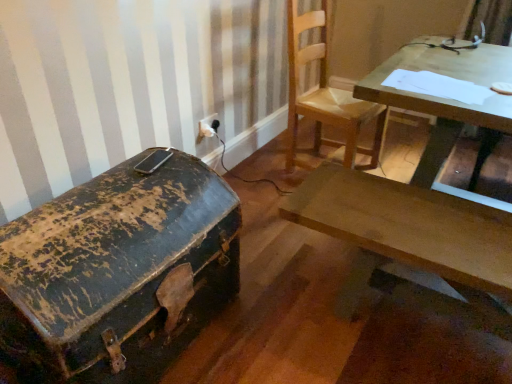
In order to face rusty metal trunk at left, should I rotate leftwards or rightwards?

To align with it, rotate left about 16.250°.

This screenshot has height=384, width=512. Describe the element at coordinates (408, 225) in the screenshot. I see `wooden desk at center` at that location.

Locate an element on the screen. white plastic electric outlet at upper center is located at coordinates (208, 126).

From the image's perspective, does white plastic electric outlet at upper center appear higher than wooden table at upper right?

Yes.

Would you say white plastic electric outlet at upper center is outside wooden table at upper right?

Yes, white plastic electric outlet at upper center is not within wooden table at upper right.

Is white plastic electric outlet at upper center to the left of wooden table at upper right from the viewer's perspective?

Yes, white plastic electric outlet at upper center is to the left of wooden table at upper right.

Is point (200, 134) positioned before point (377, 91)?

No, it is behind (377, 91).

Is rusty metal trunk at left to the left or to the right of white plastic electric outlet at upper center in the image?

rusty metal trunk at left is to the left of white plastic electric outlet at upper center.

Considering the relative sizes of rusty metal trunk at left and white plastic electric outlet at upper center in the image provided, is rusty metal trunk at left shorter than white plastic electric outlet at upper center?

Incorrect, the height of rusty metal trunk at left does not fall short of that of white plastic electric outlet at upper center.

Can white plastic electric outlet at upper center be found inside rusty metal trunk at left?

No, white plastic electric outlet at upper center is not a part of rusty metal trunk at left.

Which point is more distant from viewer, [26,234] or [212,128]?

The point [212,128] is more distant.

Does rusty metal trunk at left appear on the left side of wooden desk at center?

Yes.

Is rusty metal trunk at left far away from wooden desk at center?

No, rusty metal trunk at left is not far from wooden desk at center.

How different are the orientations of rusty metal trunk at left and wooden desk at center in degrees?

rusty metal trunk at left and wooden desk at center are facing 91.5 degrees away from each other.

From a real-world perspective, between wooden desk at center and white plastic electric outlet at upper center, who is vertically higher?

white plastic electric outlet at upper center, from a real-world perspective.

Which of these two, wooden desk at center or white plastic electric outlet at upper center, is smaller?

white plastic electric outlet at upper center is smaller.

You are a GUI agent. You are given a task and a screenshot of the screen. Output one action in this format:
    pyautogui.click(x=<x>, y=<y>)
    Task: Click on the electric outlet located behind the wooden desk at center
    Image resolution: width=512 pixels, height=384 pixels.
    Given the screenshot: What is the action you would take?
    coord(208,126)

What's the angular difference between wooden desk at center and white plastic electric outlet at upper center's facing directions?

90.5 degrees.

Are white plastic electric outlet at upper center and wooden chair at upper center far apart?

white plastic electric outlet at upper center is near wooden chair at upper center, not far away.

Would you say white plastic electric outlet at upper center contains wooden chair at upper center?

No, wooden chair at upper center is not inside white plastic electric outlet at upper center.

Between white plastic electric outlet at upper center and wooden chair at upper center, which one is positioned in front?

wooden chair at upper center is closer to the camera.

How far apart are white plastic electric outlet at upper center and wooden chair at upper center?

white plastic electric outlet at upper center and wooden chair at upper center are 31.80 inches apart from each other.

How different are the orientations of wooden chair at upper center and white plastic electric outlet at upper center in degrees?

There is a 5.22-degree angle between the facing directions of wooden chair at upper center and white plastic electric outlet at upper center.

Considering the relative sizes of wooden chair at upper center and white plastic electric outlet at upper center in the image provided, is wooden chair at upper center smaller than white plastic electric outlet at upper center?

No.

From the image's perspective, relative to white plastic electric outlet at upper center, is wooden chair at upper center above or below?

wooden chair at upper center is situated higher than white plastic electric outlet at upper center in the image.

From a real-world perspective, is wooden chair at upper center below white plastic electric outlet at upper center?

No.

Which of these two, white plastic electric outlet at upper center or rusty metal trunk at left, is bigger?

rusty metal trunk at left is bigger.

Is white plastic electric outlet at upper center not near rusty metal trunk at left?

Yes, white plastic electric outlet at upper center is far from rusty metal trunk at left.

From the image's perspective, is white plastic electric outlet at upper center on rusty metal trunk at left?

Yes, from the image's perspective, white plastic electric outlet at upper center is above rusty metal trunk at left.

Who is shorter, white plastic electric outlet at upper center or rusty metal trunk at left?

Standing shorter between the two is white plastic electric outlet at upper center.

Find the location of a particular element. Image resolution: width=512 pixels, height=384 pixels. electric outlet above the wooden table at upper right (from the image's perspective) is located at coordinates (208, 126).

In the image, there is a white plastic electric outlet at upper center. Where is `box below it (from a real-world perspective)`? box below it (from a real-world perspective) is located at coordinates (118, 273).

Looking at the image, which one is located closer to white plastic electric outlet at upper center, wooden chair at upper center or wooden table at upper right?

wooden chair at upper center lies closer to white plastic electric outlet at upper center than the other object.

Based on their spatial positions, is wooden chair at upper center or white plastic electric outlet at upper center closer to wooden table at upper right?

wooden chair at upper center is closer to wooden table at upper right.

When comparing their distances from wooden desk at center, does rusty metal trunk at left or wooden table at upper right seem further?

Among the two, rusty metal trunk at left is located further to wooden desk at center.

Considering their positions, is rusty metal trunk at left positioned closer to wooden table at upper right than white plastic electric outlet at upper center?

rusty metal trunk at left is closer to wooden table at upper right.

Which object lies further to the anchor point wooden table at upper right, white plastic electric outlet at upper center or rusty metal trunk at left?

The object further to wooden table at upper right is white plastic electric outlet at upper center.

Based on their spatial positions, is wooden chair at upper center or rusty metal trunk at left closer to wooden table at upper right?

wooden chair at upper center.

From the image, which object appears to be nearer to wooden desk at center, wooden table at upper right or white plastic electric outlet at upper center?

The object closer to wooden desk at center is wooden table at upper right.

When comparing their distances from wooden table at upper right, does rusty metal trunk at left or wooden desk at center seem closer?

The object closer to wooden table at upper right is wooden desk at center.

Where is `chair between wooden desk at center and white plastic electric outlet at upper center in the front-back direction`? The image size is (512, 384). chair between wooden desk at center and white plastic electric outlet at upper center in the front-back direction is located at coordinates (326, 95).

You are a GUI agent. You are given a task and a screenshot of the screen. Output one action in this format:
    pyautogui.click(x=<x>, y=<y>)
    Task: Click on the desk situated between white plastic electric outlet at upper center and wooden table at upper right from left to right
    The height and width of the screenshot is (384, 512).
    Given the screenshot: What is the action you would take?
    pyautogui.click(x=408, y=225)

The width and height of the screenshot is (512, 384). I want to click on desk located between rusty metal trunk at left and white plastic electric outlet at upper center in the depth direction, so click(x=408, y=225).

Image resolution: width=512 pixels, height=384 pixels. I want to click on chair located between rusty metal trunk at left and wooden table at upper right in the left-right direction, so click(x=326, y=95).